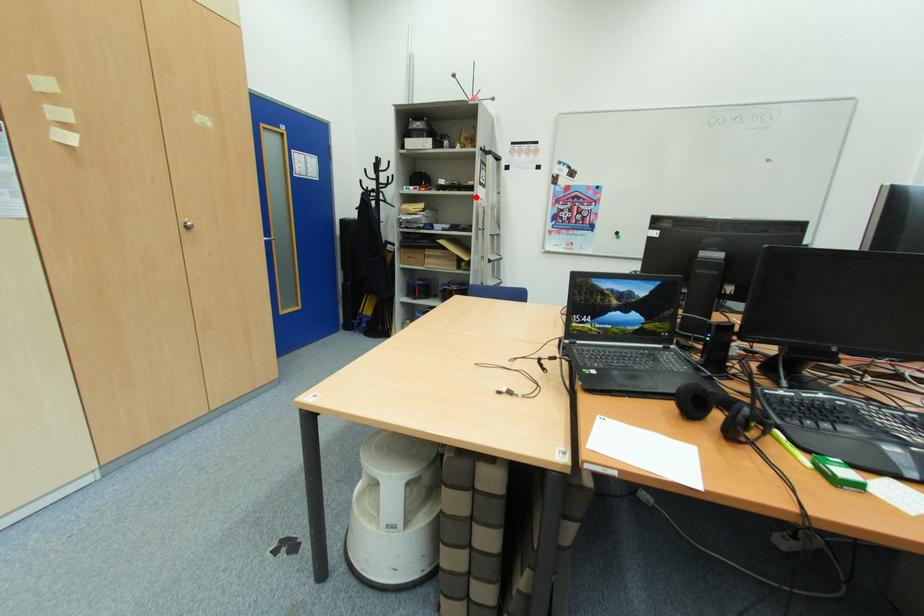
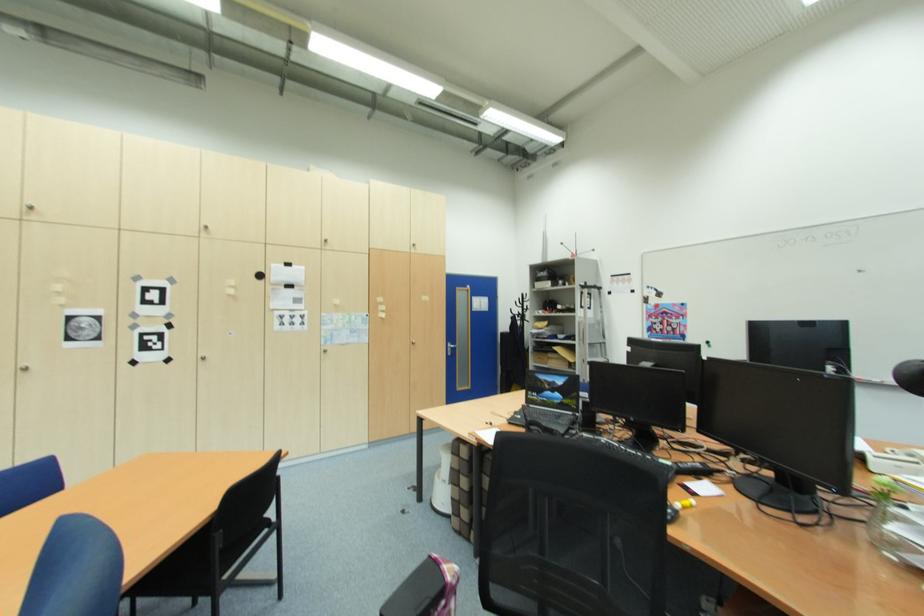
Question: I am providing you with two images of the same scene from different viewpoints. Image1 has a red point marked. In image2, the corresponding 3D location appears at what relative position? Reply with the corresponding letter.

Choices:
 (A) Closer
 (B) Farther

Answer: (B)